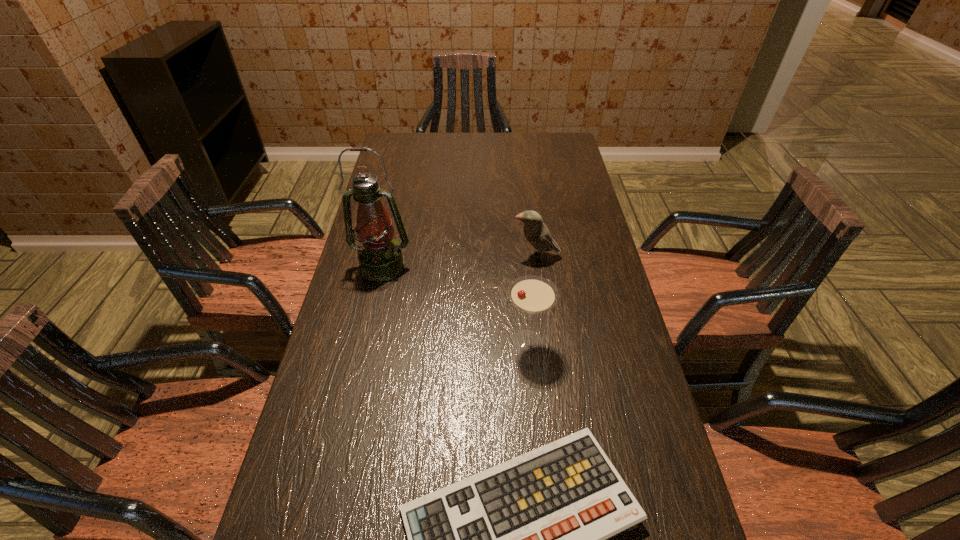
The image size is (960, 540). I want to click on the leftmost object, so click(380, 258).

At what (x,y) coordinates should I click in order to perform the action: click on oil lamp. Please return your answer as a coordinate pair (x, y). The height and width of the screenshot is (540, 960). Looking at the image, I should click on (380, 258).

Identify the location of the third farthest object. The height and width of the screenshot is (540, 960). (532, 294).

This screenshot has height=540, width=960. What are the coordinates of `bird` in the screenshot? It's located at (536, 232).

Where is `vacant area located 0.240m on the back of the oil lamp`? vacant area located 0.240m on the back of the oil lamp is located at coordinates (396, 203).

At what (x,y) coordinates should I click in order to perform the action: click on vacant area situated 0.160m on the back of the martini. Please return your answer as a coordinate pair (x, y). Looking at the image, I should click on (521, 279).

I want to click on vacant area located 0.290m at the face of the bird, so click(x=415, y=256).

Find the location of a particular element. The image size is (960, 540). vacant space situated 0.080m at the face of the bird is located at coordinates (486, 256).

Identify the location of vacant space located 0.060m at the face of the bird. (492, 256).

Identify the location of object at the left edge. (380, 258).